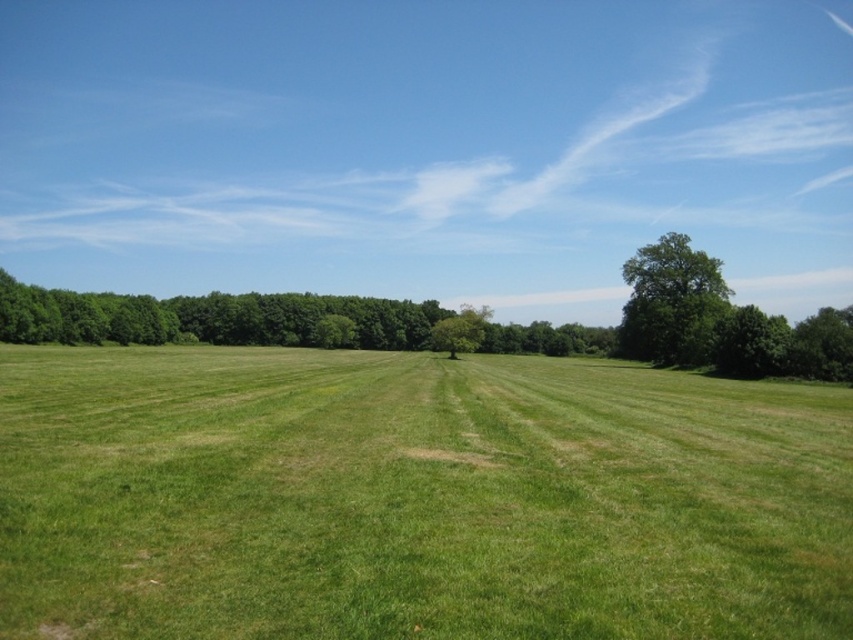
You are standing at the point labeled as point (415, 497) in the image. What type of terrain are you currently standing on?

The point (415, 497) corresponds to the green grassy field at center, so you are standing on green grassy terrain.

You are standing in the middle of the green grassy field at center and want to walk towards the green leafy tree at right. Which direction should you head?

You should head to the right because the green leafy tree at right is located to the right of the green grassy field at center.